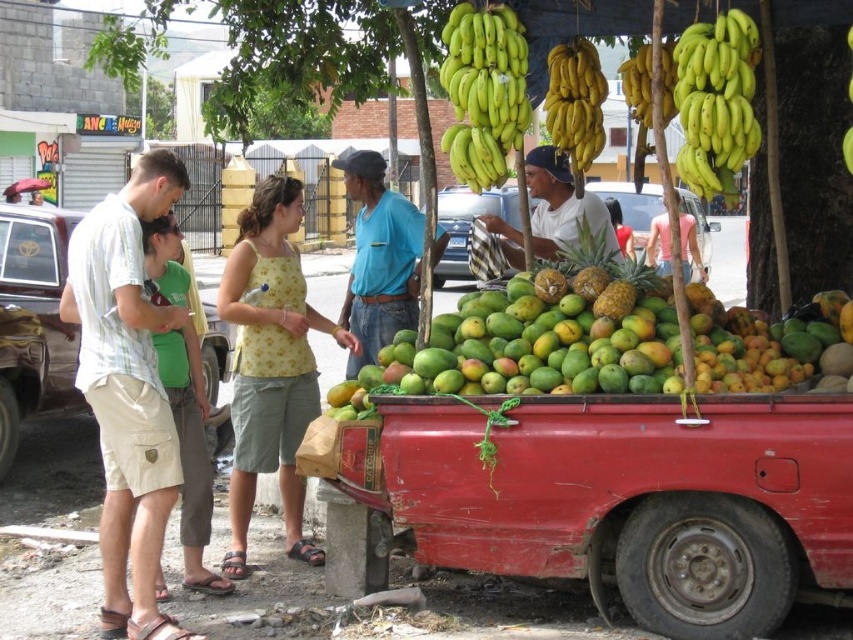
Question: Does white matte street vendor at center have a lesser width compared to green textured pineapple at center?

Choices:
 (A) yes
 (B) no

Answer: (B)

Question: Is green matte bananas at upper center smaller than yellow smooth bananas at upper center?

Choices:
 (A) yes
 (B) no

Answer: (A)

Question: Can you confirm if white matte street vendor at center is smaller than yellow matte bananas at upper center?

Choices:
 (A) no
 (B) yes

Answer: (A)

Question: Which of the following is the closest to the observer?

Choices:
 (A) green matte bananas at upper right
 (B) green textured pineapple at center

Answer: (A)

Question: Which of the following is the farthest from the observer?

Choices:
 (A) white matte street vendor at center
 (B) green matte bananas at upper center

Answer: (A)

Question: Which of these objects is positioned farthest from the yellow smooth bananas at upper center?

Choices:
 (A) green textured pineapple at center
 (B) blue cotton shirt at center

Answer: (B)